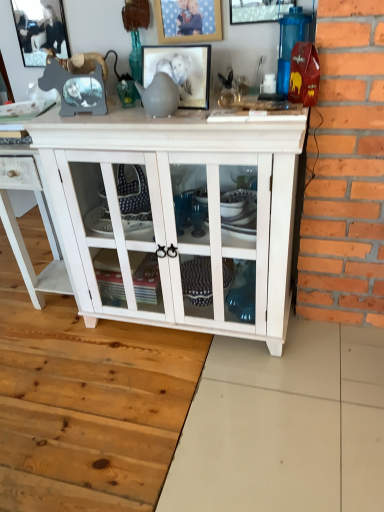
Image resolution: width=384 pixels, height=512 pixels. What are the coordinates of `free space in front of matte glass picture frame at center, which ranks as the 2th picture frame in left-to-right order` in the screenshot? It's located at (191, 115).